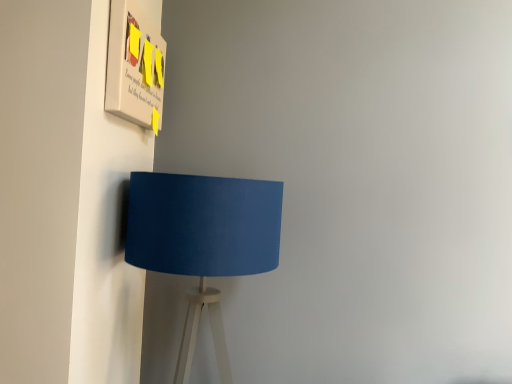
This screenshot has width=512, height=384. What do you see at coordinates (203, 240) in the screenshot? I see `matte blue lampshade at lower left` at bounding box center [203, 240].

Image resolution: width=512 pixels, height=384 pixels. Find the location of `matte blue lampshade at lower left`. matte blue lampshade at lower left is located at coordinates (203, 240).

Describe the element at coordinates (134, 65) in the screenshot. I see `matte paper poster at upper left` at that location.

The image size is (512, 384). I want to click on matte paper poster at upper left, so click(x=134, y=65).

At what (x,y) coordinates should I click in order to perform the action: click on matte blue lampshade at lower left. Please return your answer as a coordinate pair (x, y). This screenshot has width=512, height=384. Looking at the image, I should click on (203, 240).

Which is more to the left, matte paper poster at upper left or matte blue lampshade at lower left?

matte paper poster at upper left.

Is matte paper poster at upper left positioned in front of matte blue lampshade at lower left?

No, matte paper poster at upper left is behind matte blue lampshade at lower left.

Which point is more forward, [119,67] or [145,173]?

Positioned in front is point [119,67].

From the image's perspective, does matte paper poster at upper left appear lower than matte blue lampshade at lower left?

No.

From a real-world perspective, does matte paper poster at upper left sit lower than matte blue lampshade at lower left?

Actually, matte paper poster at upper left is physically above matte blue lampshade at lower left in the real world.

In terms of width, does matte paper poster at upper left look wider or thinner when compared to matte blue lampshade at lower left?

Considering their sizes, matte paper poster at upper left looks slimmer than matte blue lampshade at lower left.

Looking at this image, who is taller, matte paper poster at upper left or matte blue lampshade at lower left?

matte blue lampshade at lower left.

Can you confirm if matte paper poster at upper left is smaller than matte blue lampshade at lower left?

Indeed, matte paper poster at upper left has a smaller size compared to matte blue lampshade at lower left.

Is matte paper poster at upper left surrounding matte blue lampshade at lower left?

No, matte blue lampshade at lower left is not inside matte paper poster at upper left.

Would you say matte paper poster at upper left is a long distance from matte blue lampshade at lower left?

No, matte paper poster at upper left is not far away from matte blue lampshade at lower left.

Looking at this image, is matte paper poster at upper left facing towards matte blue lampshade at lower left?

No, matte paper poster at upper left is not oriented towards matte blue lampshade at lower left.

Locate an element on the screen. The width and height of the screenshot is (512, 384). poster behind the matte blue lampshade at lower left is located at coordinates (134, 65).

Considering the relative positions of matte blue lampshade at lower left and matte paper poster at upper left in the image provided, is matte blue lampshade at lower left to the left or to the right of matte paper poster at upper left?

Clearly, matte blue lampshade at lower left is on the right of matte paper poster at upper left in the image.

Which is in front, matte blue lampshade at lower left or matte paper poster at upper left?

matte blue lampshade at lower left.

Does point (213, 237) come behind point (148, 109)?

That is False.

Based on the photo, from the image's perspective, between matte blue lampshade at lower left and matte paper poster at upper left, who is located below?

From the image's view, matte blue lampshade at lower left is below.

From a real-world perspective, which object stands above the other?

In real-world perspective, matte paper poster at upper left is above.

Is matte blue lampshade at lower left wider than matte paper poster at upper left?

Yes.

Considering the sizes of matte blue lampshade at lower left and matte paper poster at upper left in the image, is matte blue lampshade at lower left taller or shorter than matte paper poster at upper left?

Clearly, matte blue lampshade at lower left is taller compared to matte paper poster at upper left.

Based on their sizes in the image, would you say matte blue lampshade at lower left is bigger or smaller than matte paper poster at upper left?

matte blue lampshade at lower left is bigger than matte paper poster at upper left.

Do you think matte blue lampshade at lower left is within matte paper poster at upper left, or outside of it?

matte blue lampshade at lower left is outside matte paper poster at upper left.

Does matte blue lampshade at lower left touch matte paper poster at upper left?

No, matte blue lampshade at lower left is not making contact with matte paper poster at upper left.

Is matte blue lampshade at lower left turned away from matte paper poster at upper left?

No, matte blue lampshade at lower left's orientation is not away from matte paper poster at upper left.

How distant is matte blue lampshade at lower left from matte paper poster at upper left?

A distance of 34.13 centimeters exists between matte blue lampshade at lower left and matte paper poster at upper left.

Identify the location of lamp below the matte paper poster at upper left (from a real-world perspective). (203, 240).

Image resolution: width=512 pixels, height=384 pixels. Find the location of `poster that is above the matte blue lampshade at lower left (from a real-world perspective)`. poster that is above the matte blue lampshade at lower left (from a real-world perspective) is located at coordinates (134, 65).

The image size is (512, 384). I want to click on lamp located on the right of matte paper poster at upper left, so tap(203, 240).